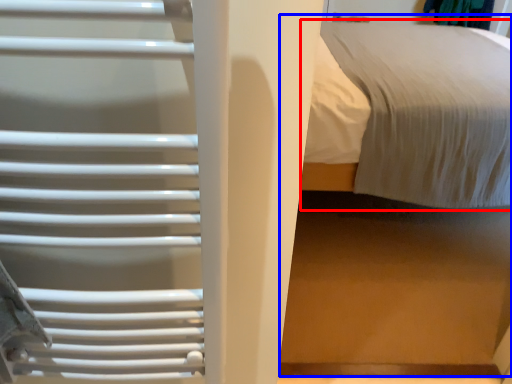
Question: Which object is closer to the camera taking this photo, bed (highlighted by a red box) or bed (highlighted by a blue box)?

Choices:
 (A) bed
 (B) bed

Answer: (B)